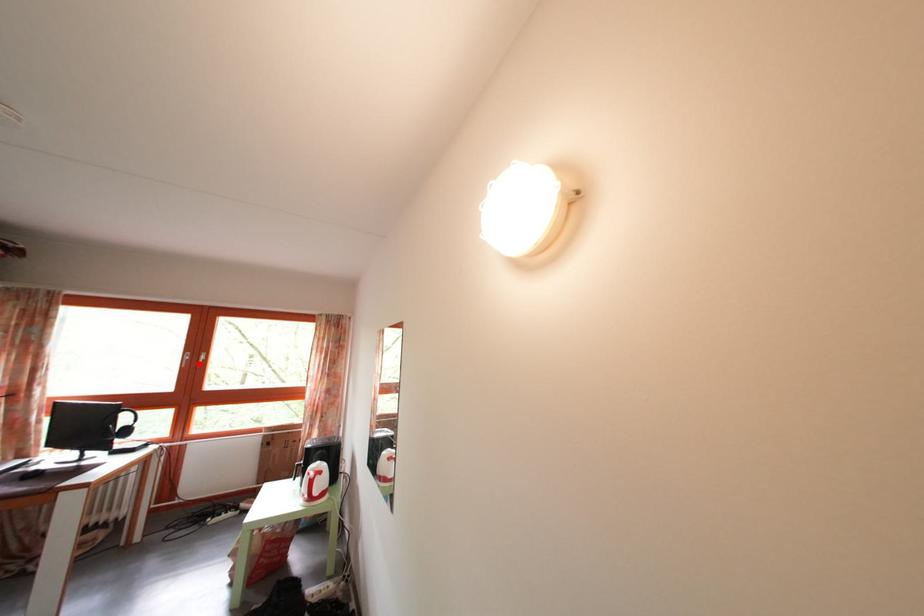
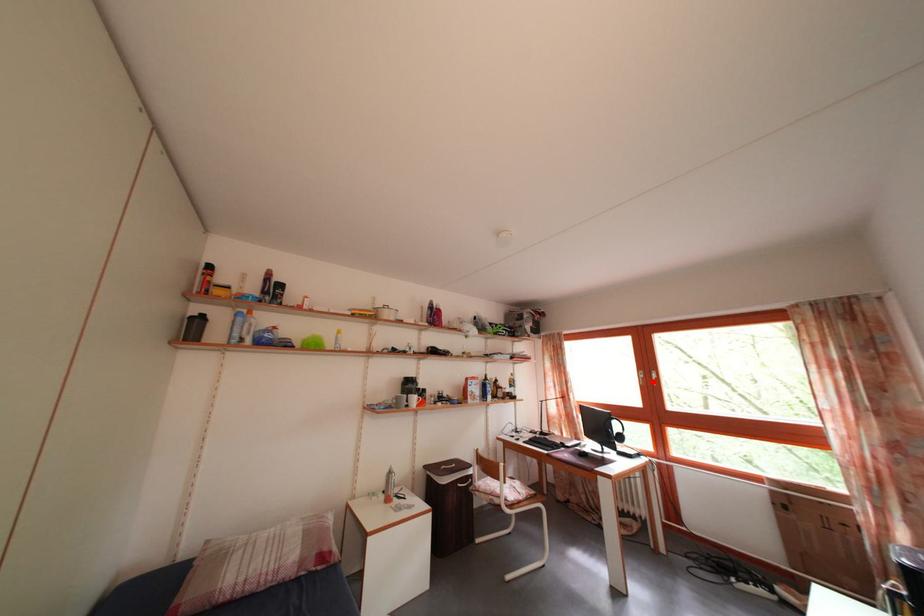
I am providing you with two images of the same scene from different viewpoints. A red point is marked on the first image and another point is marked on the second image. Is the marked point in image1 the same physical position as the marked point in image2?

Yes